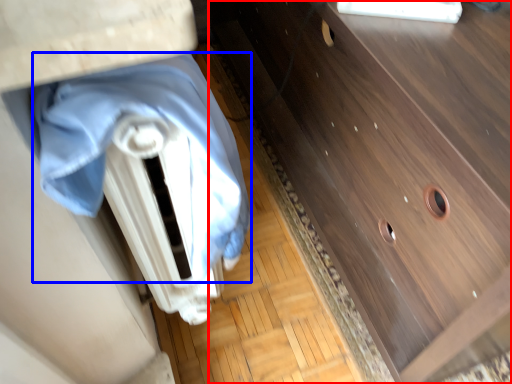
Question: Which object is closer to the camera taking this photo, chest of drawers (highlighted by a red box) or blanket (highlighted by a blue box)?

Choices:
 (A) chest of drawers
 (B) blanket

Answer: (B)